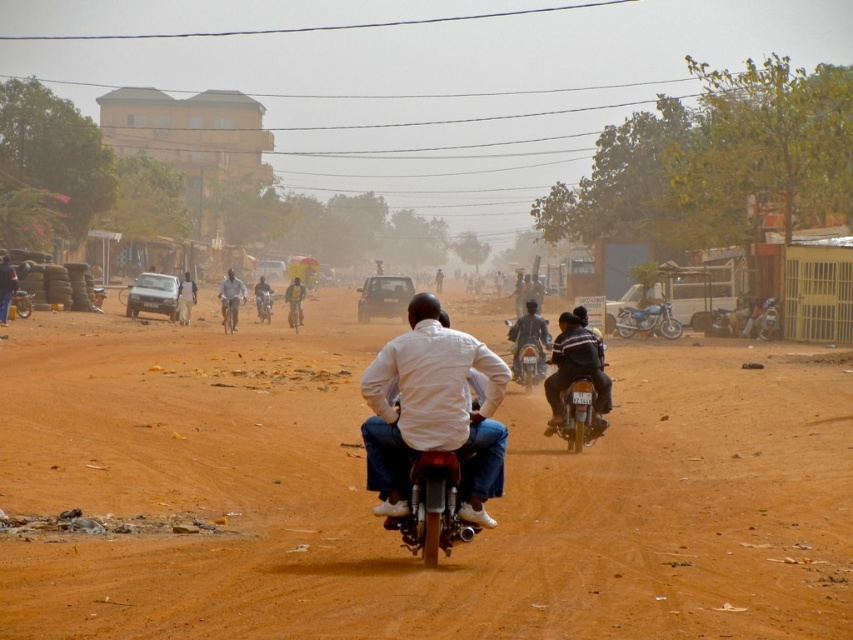
Consider the image. Which is more to the right, metallic blue motorcycle at center or light gray metallic motorcycle at center?

metallic blue motorcycle at center is more to the right.

Locate an element on the screen. The height and width of the screenshot is (640, 853). metallic blue motorcycle at center is located at coordinates (647, 321).

Does point (532, 634) come behind point (538, 353)?

No, (532, 634) is in front of (538, 353).

Is point (96, 378) closer to camera compared to point (537, 314)?

Yes, it is.

Find the location of a particular element. The width and height of the screenshot is (853, 640). brown sandy ground at center is located at coordinates (393, 534).

Can you confirm if white matte shirt at center is smaller than light gray metallic motorcycle at center?

Correct, white matte shirt at center occupies less space than light gray metallic motorcycle at center.

Does white matte shirt at center have a larger size compared to light gray metallic motorcycle at center?

Actually, white matte shirt at center might be smaller than light gray metallic motorcycle at center.

Between point (393, 476) and point (224, 276), which one is positioned in front?

Positioned in front is point (393, 476).

Find the location of `white matte shirt at center`. white matte shirt at center is located at coordinates (432, 410).